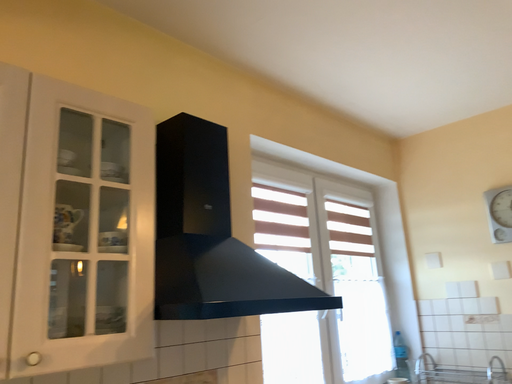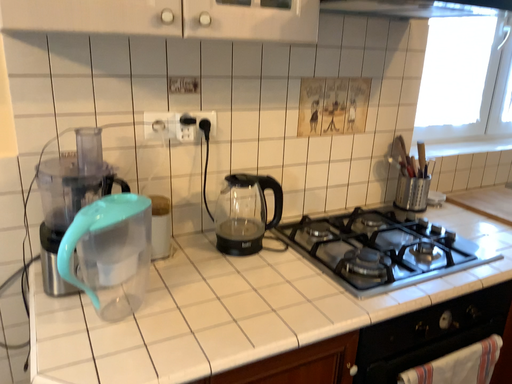
Question: Which way did the camera rotate in the video?

Choices:
 (A) rotated right
 (B) rotated left

Answer: (B)